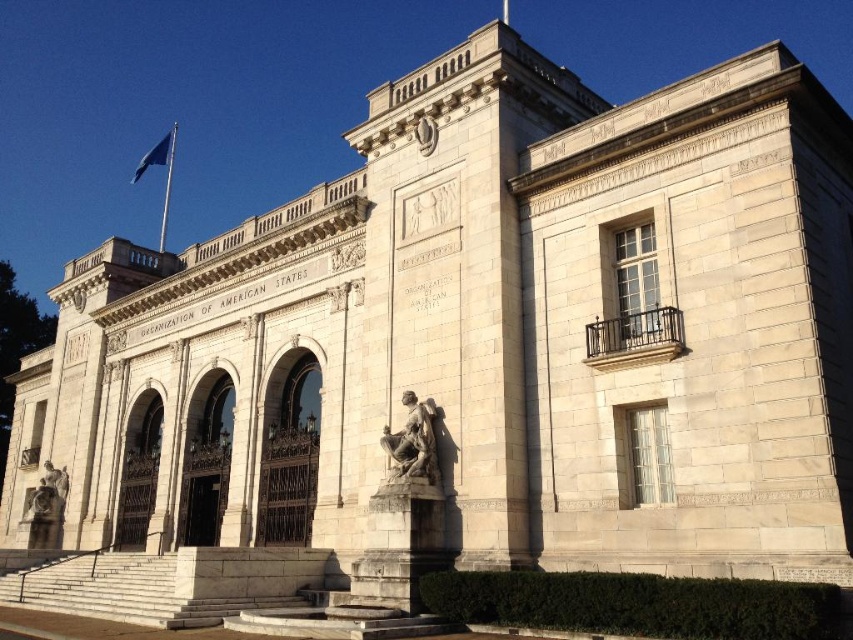
Between bronze statue at lower left and blue fabric flag at upper left, which one is positioned higher?

blue fabric flag at upper left is higher up.

Can you confirm if bronze statue at lower left is positioned to the right of blue fabric flag at upper left?

Correct, you'll find bronze statue at lower left to the right of blue fabric flag at upper left.

Image resolution: width=853 pixels, height=640 pixels. What are the coordinates of `bronze statue at lower left` in the screenshot? It's located at pos(48,496).